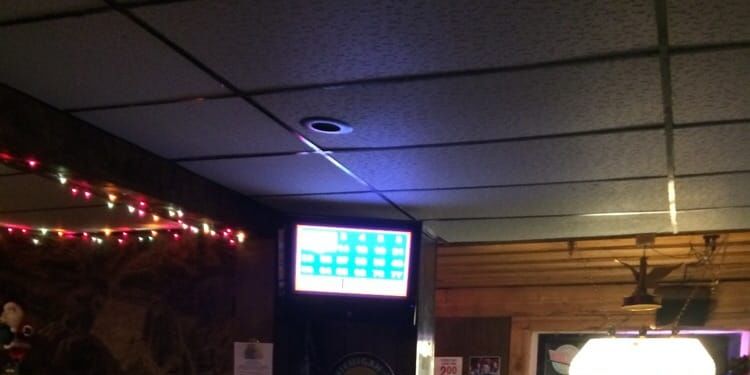
Where is `silver metal frame rods ceiling boards mounted on`? The image size is (750, 375). silver metal frame rods ceiling boards mounted on is located at coordinates (670, 155).